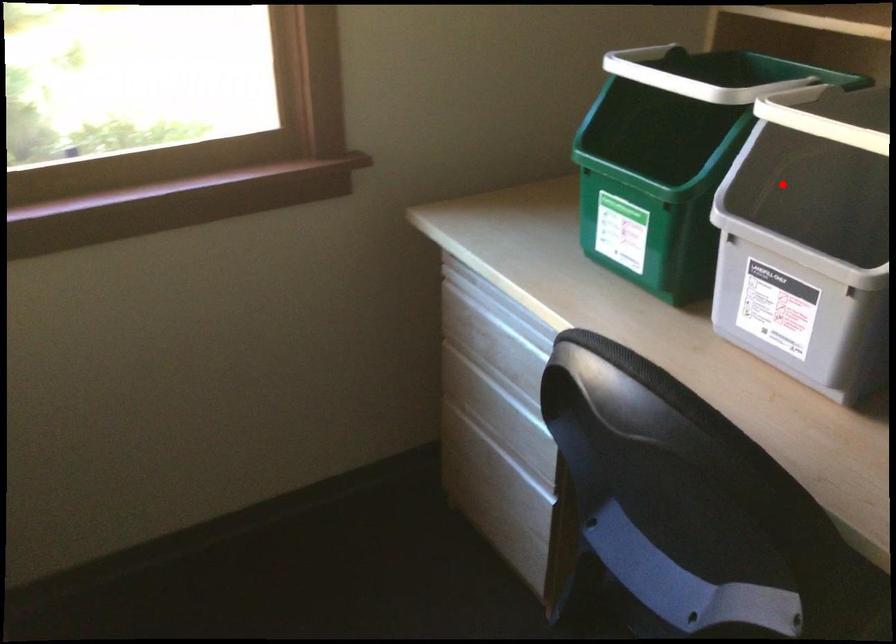
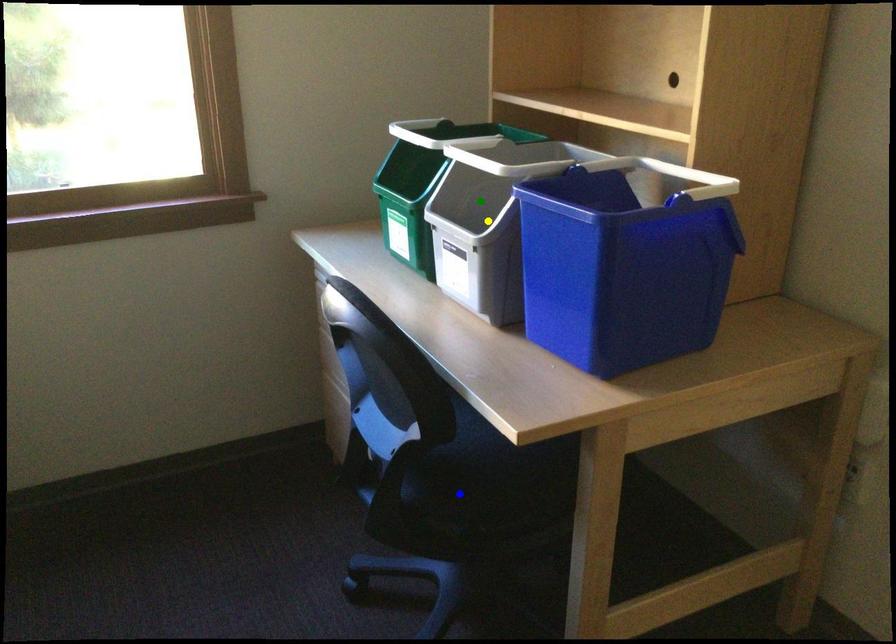
Question: I am providing you with two images of the same scene from different viewpoints. A red point is marked on the first image. You are given multiple points on the second image. In image 2, which mark is for the same physical point as the one in image 1?

Choices:
 (A) green point
 (B) yellow point
 (C) blue point

Answer: (A)